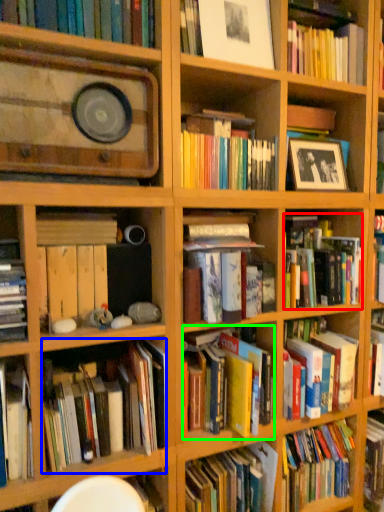
Question: Based on their relative distances, which object is nearer to book (highlighted by a red box)? Choose from book (highlighted by a blue box) and book (highlighted by a green box).

Choices:
 (A) book
 (B) book

Answer: (B)